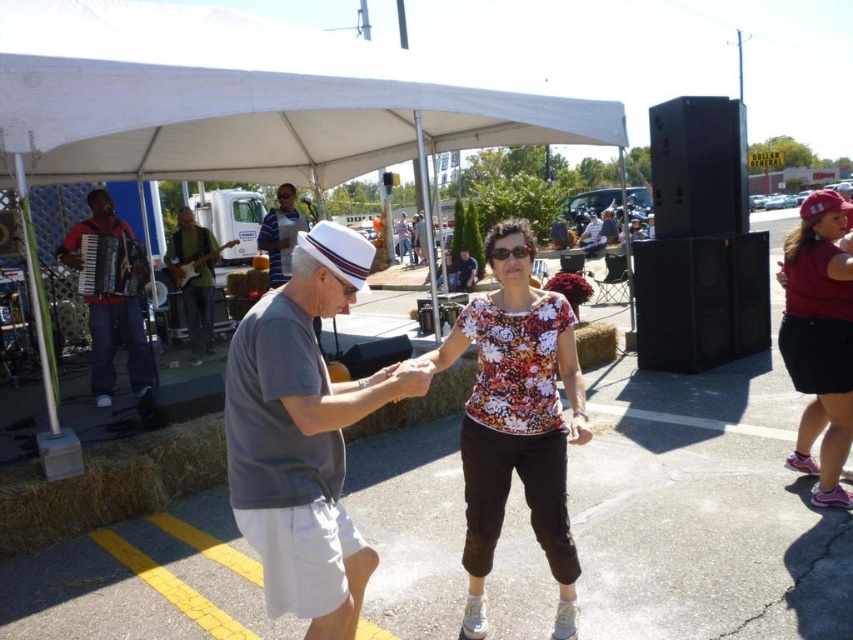
Question: Which object is farther from the camera taking this photo?

Choices:
 (A) matte red cap at right
 (B) floral fabric blouse at center
 (C) striped shirt at center
 (D) gray cotton shirt at center

Answer: (C)

Question: Can you confirm if gray cotton shirt at center is thinner than floral fabric blouse at center?

Choices:
 (A) no
 (B) yes

Answer: (A)

Question: Considering the real-world distances, which object is farthest from the matte black accordion at left?

Choices:
 (A) striped shirt at center
 (B) matte black guitar at center

Answer: (B)

Question: Does matte black accordion at left appear on the left side of striped shirt at center?

Choices:
 (A) yes
 (B) no

Answer: (A)

Question: Does floral fabric blouse at center appear on the left side of wooden electric guitar at center?

Choices:
 (A) yes
 (B) no

Answer: (B)

Question: Which of the following is the farthest from the observer?

Choices:
 (A) matte black guitar at center
 (B) wooden electric guitar at center
 (C) matte black accordion at left

Answer: (A)